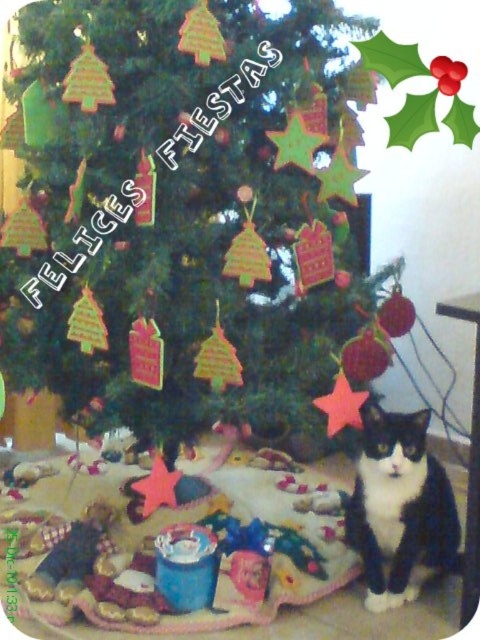
Question: Can you confirm if green matte christmas tree at center is bigger than black and white fur cat at lower right?

Choices:
 (A) yes
 (B) no

Answer: (A)

Question: Is green matte christmas tree at center wider than black and white fur cat at lower right?

Choices:
 (A) yes
 (B) no

Answer: (A)

Question: Which of the following is the farthest from the observer?

Choices:
 (A) green matte christmas tree at center
 (B) black and white fur cat at lower right

Answer: (B)

Question: Does green matte christmas tree at center have a smaller size compared to black and white fur cat at lower right?

Choices:
 (A) no
 (B) yes

Answer: (A)

Question: Among these points, which one is farthest from the camera?

Choices:
 (A) (400, 513)
 (B) (73, 189)

Answer: (A)